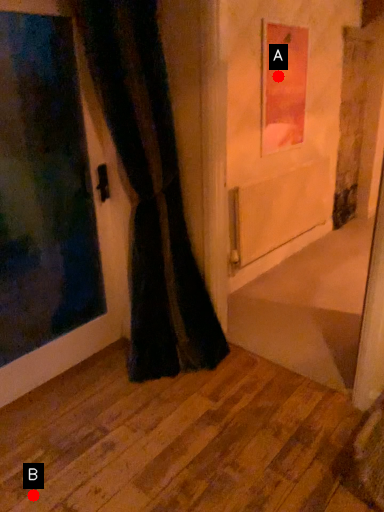
Question: Two points are circled on the image, labeled by A and B beside each circle. Which point is closer to the camera?

Choices:
 (A) A is closer
 (B) B is closer

Answer: (B)